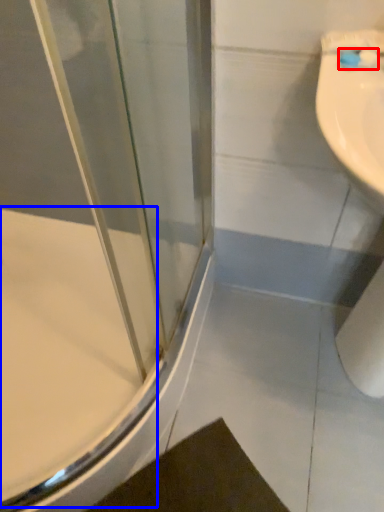
Question: Which point is further to the camera, toothbrush (highlighted by a red box) or bath (highlighted by a blue box)?

Choices:
 (A) toothbrush
 (B) bath

Answer: (B)